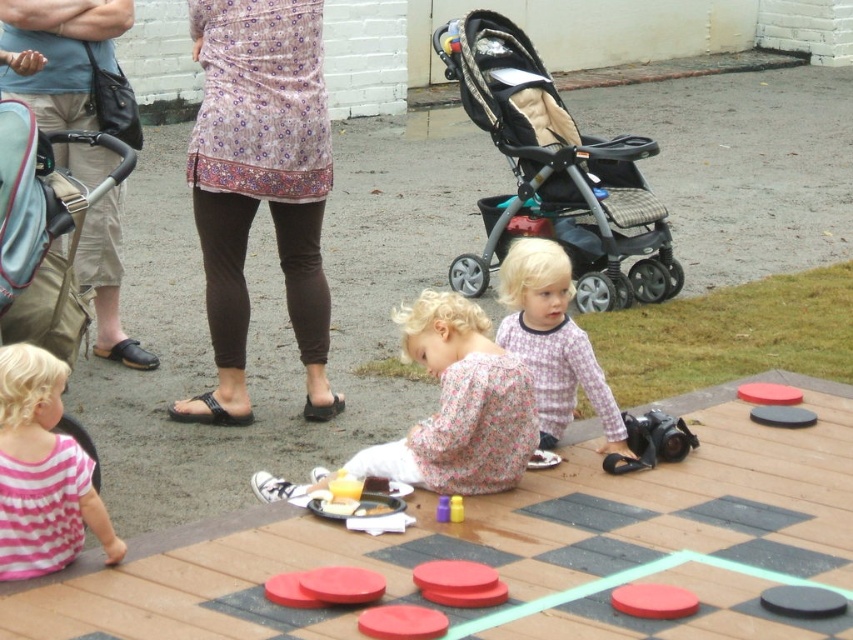
Question: Which point is farther to the camera?

Choices:
 (A) black textured stroller at upper right
 (B) floral fabric dress at center

Answer: (A)

Question: Is floral cotton shirt at center to the right of rubber duck at center from the viewer's perspective?

Choices:
 (A) yes
 (B) no

Answer: (A)

Question: Observing the image, what is the correct spatial positioning of floral fabric dress at center in reference to pink striped fabric at lower left?

Choices:
 (A) above
 (B) below

Answer: (B)

Question: Which object is the closest to the pink striped fabric at lower left?

Choices:
 (A) light blue cotton shirt at upper left
 (B) smooth red disc at center
 (C) floral fabric dress at center

Answer: (B)

Question: Which object is farther from the camera taking this photo?

Choices:
 (A) printed cotton tunic at center
 (B) floral fabric dress at center
 (C) black textured stroller at upper right

Answer: (C)

Question: From the image, what is the correct spatial relationship of light blue cotton shirt at upper left in relation to pink striped fabric at lower left?

Choices:
 (A) right
 (B) left

Answer: (B)